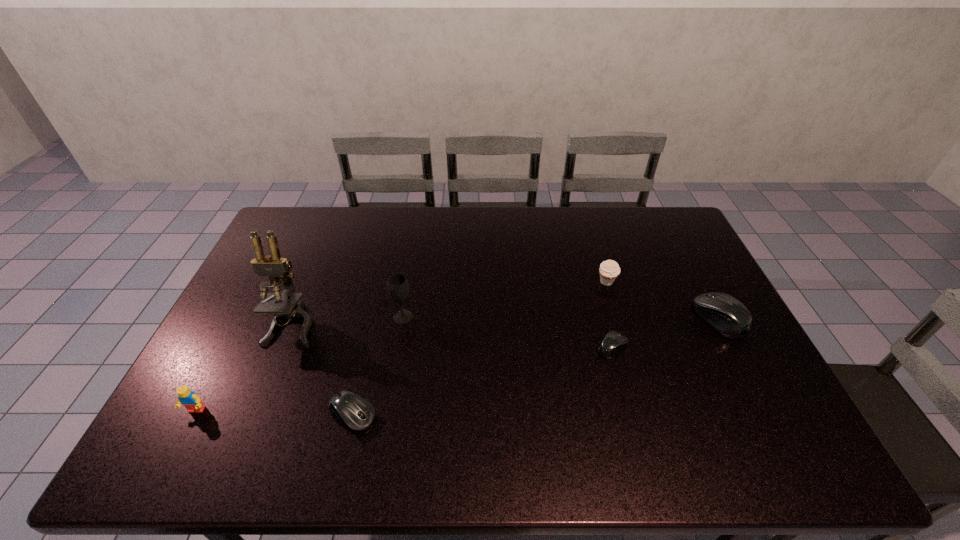
If we want them evenly spaced by inserting an extra mouse_(computer_equipment) among them, please locate a free spot for this new mouse_(computer_equipment). Please provide its 2D coordinates. Your answer should be formatted as a tuple, i.e. [(x, y)], where the tuple contains the x and y coordinates of a point satisfying the conditions above.

[(492, 379)]